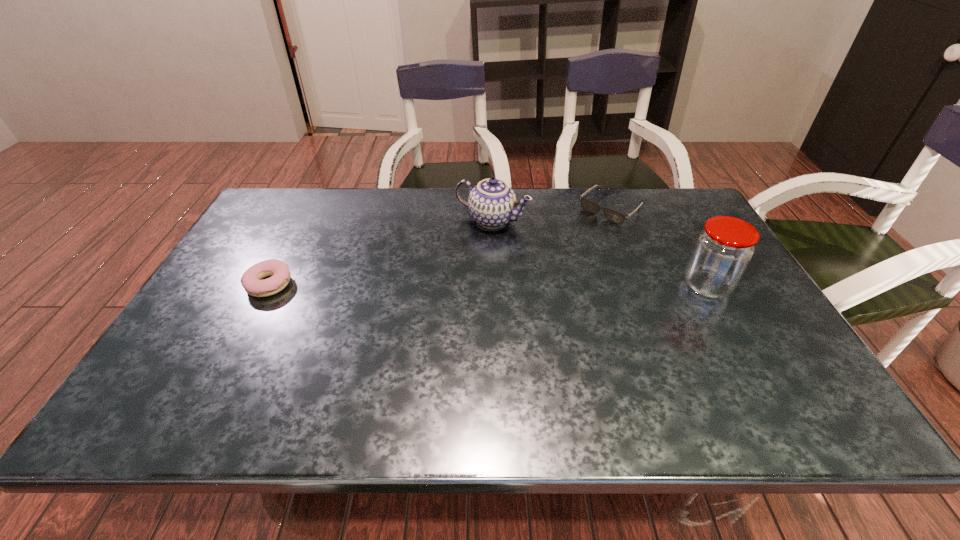
Where is `vacant space located 0.160m on the front-facing side of the third object from left to right`? The height and width of the screenshot is (540, 960). vacant space located 0.160m on the front-facing side of the third object from left to right is located at coordinates tap(566, 246).

This screenshot has width=960, height=540. I want to click on vacant region located 0.060m at the spout of the chinaware, so (466, 244).

In order to click on vacant region located 0.110m at the spout of the chinaware in this screenshot , I will do `click(458, 253)`.

Where is `free region located at the spout of the chinaware`? The width and height of the screenshot is (960, 540). free region located at the spout of the chinaware is located at coordinates (409, 308).

What are the coordinates of `sunglasses located at the far edge` in the screenshot? It's located at (614, 216).

The height and width of the screenshot is (540, 960). I want to click on chinaware present at the far edge, so click(492, 203).

In order to click on object situated at the left edge in this screenshot , I will do `click(251, 281)`.

You are a GUI agent. You are given a task and a screenshot of the screen. Output one action in this format:
    pyautogui.click(x=<x>, y=<y>)
    Task: Click on the object at the right edge
    The width and height of the screenshot is (960, 540).
    Given the screenshot: What is the action you would take?
    pyautogui.click(x=723, y=250)

In the image, there is a desktop. Where is `vacant area at the far edge`? This screenshot has height=540, width=960. vacant area at the far edge is located at coordinates point(569,228).

Find the location of a particular element. The image size is (960, 540). blank space at the near edge of the desktop is located at coordinates (400, 382).